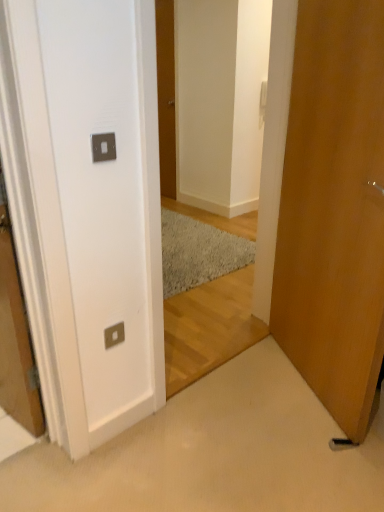
Question: Is wooden door at right, acting as the second door starting from the back, shorter than wooden door at center, placed as the second door when sorted from front to back?

Choices:
 (A) yes
 (B) no

Answer: (A)

Question: Considering the relative sizes of wooden door at right, acting as the second door starting from the top, and wooden door at center, marked as the second door in a bottom-to-top arrangement, in the image provided, is wooden door at right, acting as the second door starting from the top, wider than wooden door at center, marked as the second door in a bottom-to-top arrangement,?

Choices:
 (A) no
 (B) yes

Answer: (B)

Question: Is the position of wooden door at right, which is the 2th door from left to right, more distant than that of wooden door at center, placed as the second door when sorted from front to back?

Choices:
 (A) no
 (B) yes

Answer: (A)

Question: Is wooden door at right, acting as the second door starting from the back, not near wooden door at center, placed as the second door when sorted from front to back?

Choices:
 (A) yes
 (B) no

Answer: (A)

Question: Is wooden door at right, arranged as the first door when viewed from the right, thinner than wooden door at center, placed as the second door when sorted from front to back?

Choices:
 (A) yes
 (B) no

Answer: (B)

Question: From a real-world perspective, is satin silver switchplate at lower left above or below wooden door at right, the 1th door positioned from the front?

Choices:
 (A) below
 (B) above

Answer: (A)

Question: Does point (112, 332) appear closer or farther from the camera than point (309, 376)?

Choices:
 (A) closer
 (B) farther

Answer: (A)

Question: Choose the correct answer: Is satin silver switchplate at lower left inside wooden door at right, which is counted as the 1th door, starting from the bottom, or outside it?

Choices:
 (A) inside
 (B) outside

Answer: (B)

Question: From the image's perspective, relative to wooden door at right, arranged as the first door when viewed from the right, is satin silver switchplate at lower left above or below?

Choices:
 (A) above
 (B) below

Answer: (B)

Question: Is satin silver switchplate at lower left bigger or smaller than wooden door at center, marked as the second door in a bottom-to-top arrangement?

Choices:
 (A) small
 (B) big

Answer: (A)

Question: Based on their positions, is satin silver switchplate at lower left located to the left or right of wooden door at center, marked as the 1th door in a left-to-right arrangement?

Choices:
 (A) right
 (B) left

Answer: (A)

Question: Is satin silver switchplate at lower left situated inside wooden door at center, marked as the 1th door in a left-to-right arrangement, or outside?

Choices:
 (A) outside
 (B) inside

Answer: (A)

Question: From a real-world perspective, is satin silver switchplate at lower left above or below wooden door at center, placed as the first door when sorted from back to front?

Choices:
 (A) above
 (B) below

Answer: (B)

Question: In terms of height, does wooden door at right, arranged as the first door when viewed from the right, look taller or shorter compared to satin silver switchplate at lower left?

Choices:
 (A) short
 (B) tall

Answer: (B)

Question: From the image's perspective, is wooden door at right, which is the 2th door from left to right, above or below satin silver switchplate at lower left?

Choices:
 (A) below
 (B) above

Answer: (B)